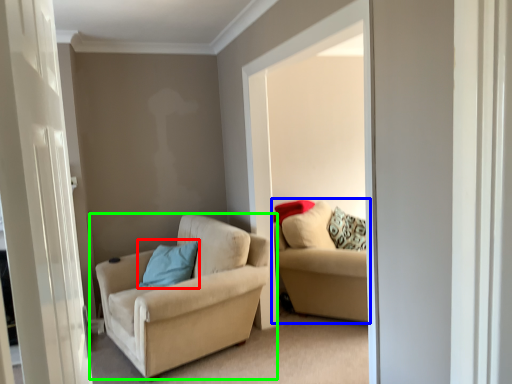
Question: Estimate the real-world distances between objects in this image. Which object is farther from pillow (highlighted by a red box), studio couch (highlighted by a blue box) or chair (highlighted by a green box)?

Choices:
 (A) studio couch
 (B) chair

Answer: (A)